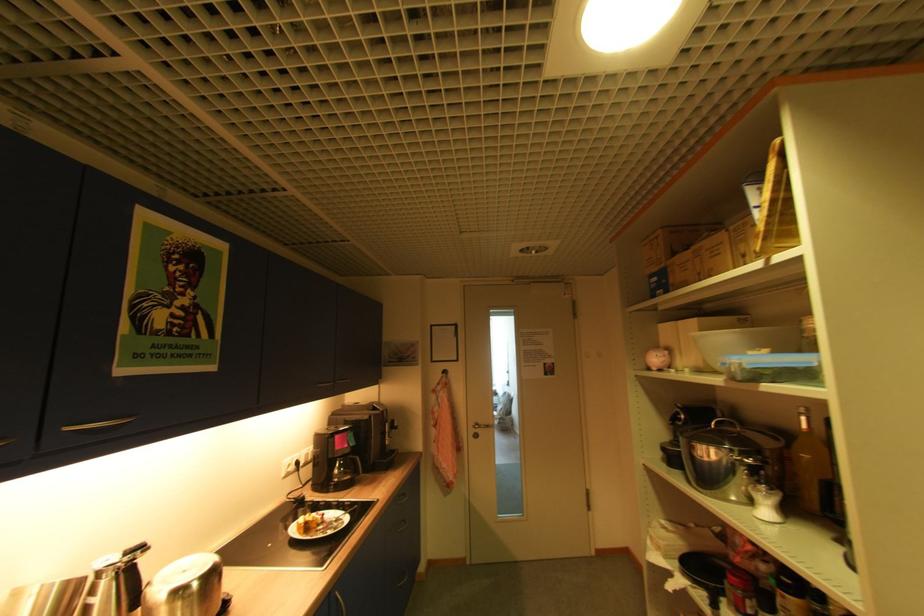
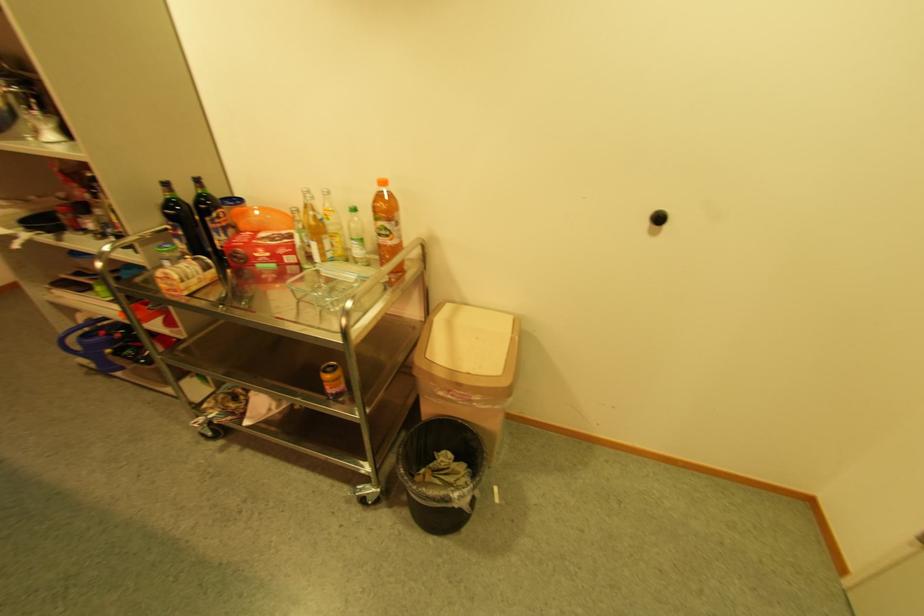
First-person continuous shooting, in which direction is the camera rotating?

The camera rotated toward right-down.